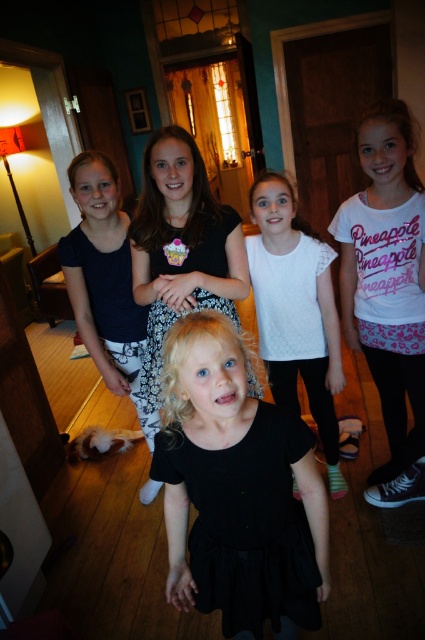
Can you confirm if white cotton shirt at upper right is bigger than black cotton dress at center?

Indeed, white cotton shirt at upper right has a larger size compared to black cotton dress at center.

Does white cotton shirt at upper right appear on the right side of black cotton dress at center?

Correct, you'll find white cotton shirt at upper right to the right of black cotton dress at center.

Locate an element on the screen. This screenshot has width=425, height=640. white cotton shirt at upper right is located at coordinates (388, 291).

Is black matte dress at center smaller than white cotton shirt at upper right?

Yes.

Which is behind, point (206, 472) or point (414, 454)?

Point (414, 454)

Locate an element on the screen. black matte dress at center is located at coordinates (246, 522).

Does black matte dress at center have a lesser width compared to white textured shirt at center?

Indeed, black matte dress at center has a lesser width compared to white textured shirt at center.

Can you confirm if black matte dress at center is positioned to the right of white textured shirt at center?

In fact, black matte dress at center is to the left of white textured shirt at center.

At what (x,y) coordinates should I click in order to perform the action: click on black matte dress at center. Please return your answer as a coordinate pair (x, y). The width and height of the screenshot is (425, 640). Looking at the image, I should click on (246, 522).